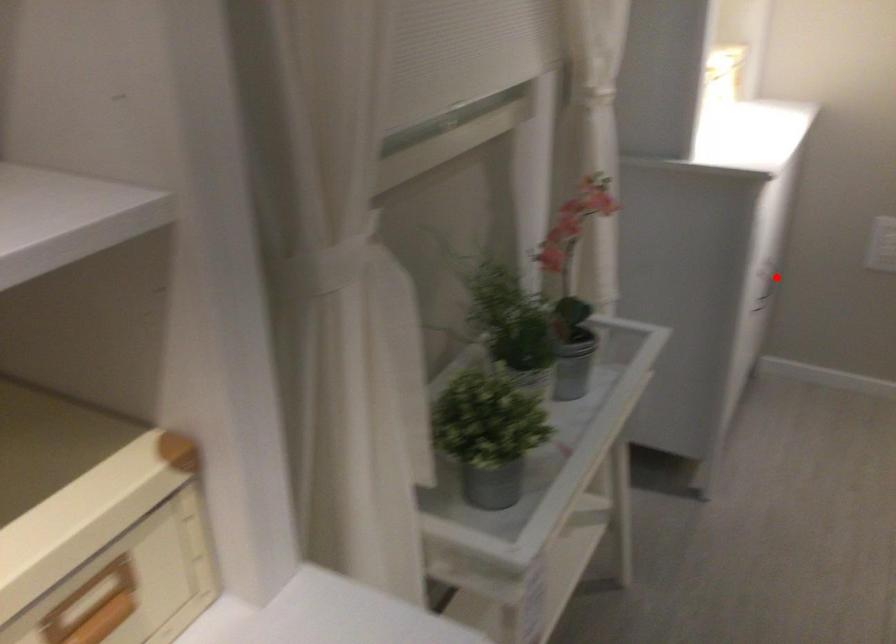
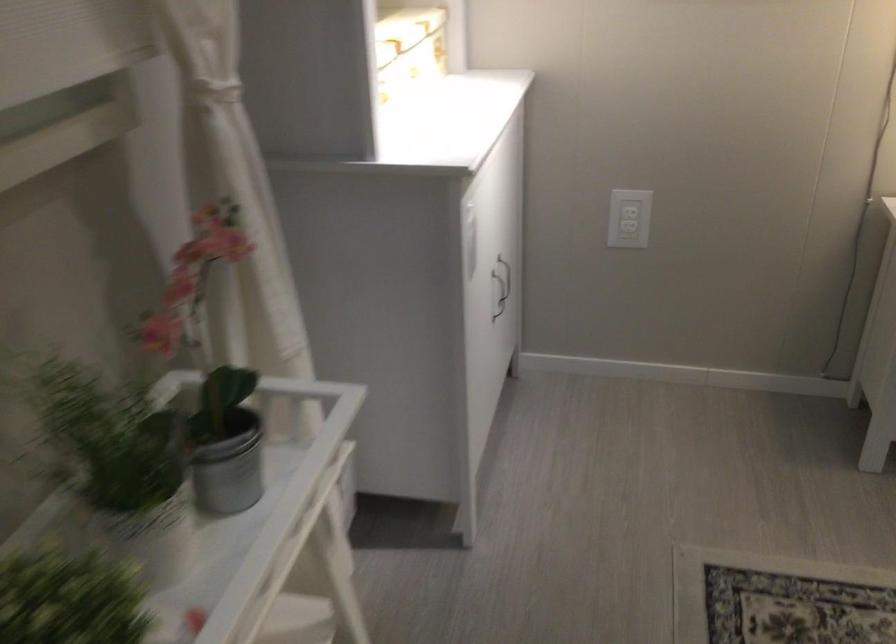
Question: I am providing you with two images of the same scene from different viewpoints. Given a red point in image1, look at the same physical point in image2. Is it:

Choices:
 (A) Closer to the viewpoint
 (B) Farther from the viewpoint

Answer: (A)